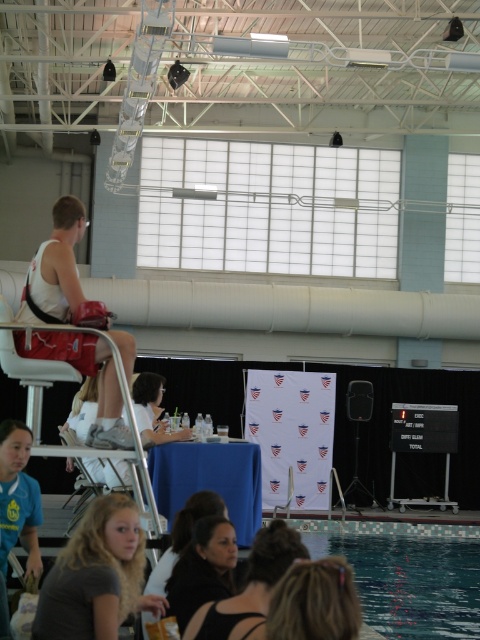
You are a photographer at the event and need to capture a photo of both the black fabric hair at center and the matte white shirt at center. Based on their positions, which object should you adjust your camera to focus on first to ensure both are in the frame?

The black fabric hair at center is to the right of the matte white shirt at center. To ensure both are in the frame, focus on the matte white shirt at center first, then adjust the camera to include the black fabric hair at center to the right.

You are a swimmer standing at the diving platform at the left side of the pool. You want to walk to the blue table in the foreground. Which direction should you move to reach the blue table first, considering the positions of point (x=307, y=524) and point (x=133, y=392)?

To reach the blue table first, you should move towards point (x=133, y=392) because it is closer to you than point (x=307, y=524), which is further away.